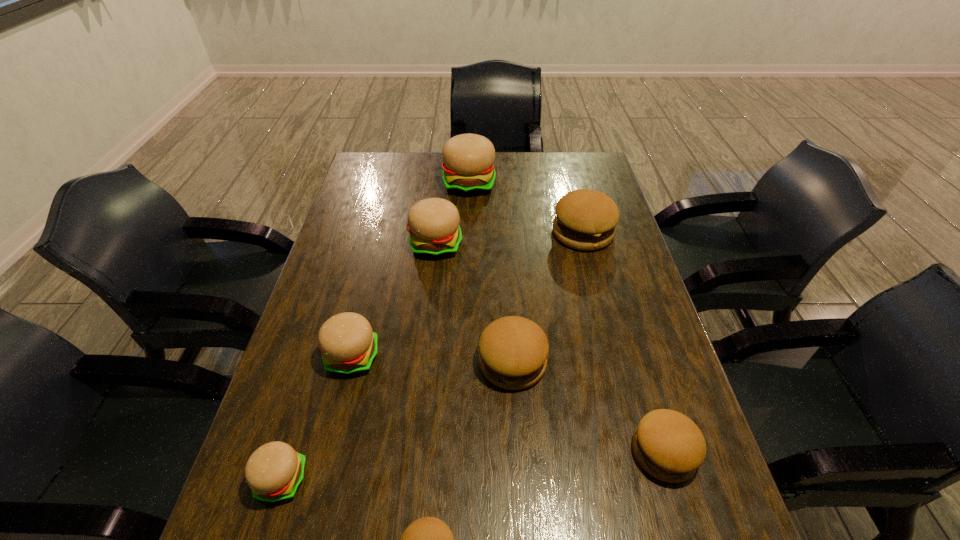
Find the location of a particular element. vacant space at the far left corner is located at coordinates (381, 156).

The width and height of the screenshot is (960, 540). I want to click on vacant space at the far right corner of the desktop, so click(x=560, y=166).

Locate an element on the screen. Image resolution: width=960 pixels, height=540 pixels. empty space that is in between the biggest brown hamburger and the second brown hamburger from left to right is located at coordinates point(547,298).

The image size is (960, 540). I want to click on vacant area between the third smallest beige hamburger and the farthest brown hamburger, so click(x=510, y=239).

Identify the location of vacant point located between the second smallest beige hamburger and the smallest beige hamburger. The height and width of the screenshot is (540, 960). (317, 418).

Find the location of a particular element. The height and width of the screenshot is (540, 960). empty space between the tallest hamburger and the second smallest beige hamburger is located at coordinates (411, 271).

Find the location of `empty location between the second nearest brown hamburger and the second brown hamburger from left to right`. empty location between the second nearest brown hamburger and the second brown hamburger from left to right is located at coordinates (588, 407).

Locate an element on the screen. Image resolution: width=960 pixels, height=540 pixels. vacant space that's between the nearest beige hamburger and the tallest hamburger is located at coordinates (375, 332).

I want to click on free area in between the third farthest beige hamburger and the nearest beige hamburger, so click(317, 418).

Find the location of `the seventh closest object to the third nearest brown hamburger`. the seventh closest object to the third nearest brown hamburger is located at coordinates (468, 169).